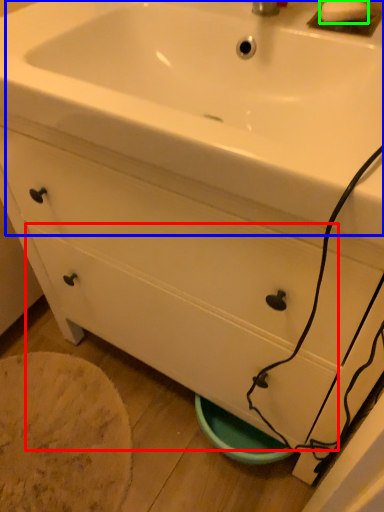
Question: Based on their relative distances, which object is farther from drawer (highlighted by a red box)? Choose from sink (highlighted by a blue box) and soap (highlighted by a green box).

Choices:
 (A) sink
 (B) soap

Answer: (B)